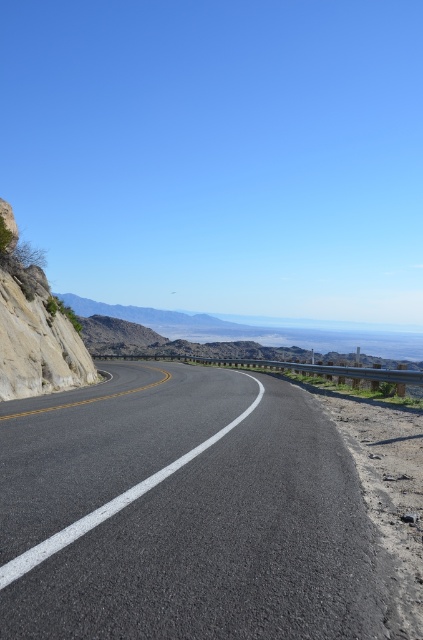
You are a GPS navigator planning a route through the winding two lane road. The black asphalt road at center is at point 0.803, 0.433. Is the road at that point on the left or right side of the image?

The black asphalt road at center is located at point (x=183, y=513), which is the center of the image, so it is neither on the left nor the right side.

You are a driver approaching the black asphalt road at center and the rocky cliff at left. Which object appears smaller in the image?

The black asphalt road at center appears smaller than the rocky cliff at left in the image.

You are a hiker standing on the rocky cliff at left and want to cross to the black asphalt road at center. Is the road directly below the cliff, or is there a gap between them?

The black asphalt road at center is positioned under rocky cliff at left, so the road is directly below the cliff with no gap between them.